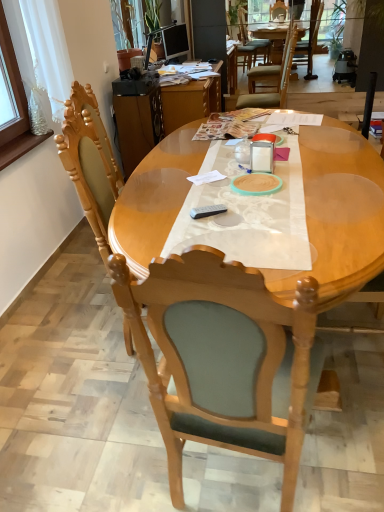
Question: Considering the relative positions of light wood table at center and wooden chair at center, placed as the 2th chair when sorted from back to front, in the image provided, is light wood table at center to the left of wooden chair at center, placed as the 2th chair when sorted from back to front, from the viewer's perspective?

Choices:
 (A) no
 (B) yes

Answer: (A)

Question: Does light wood table at center contain wooden chair at center, marked as the 1th chair in a bottom-to-top arrangement?

Choices:
 (A) yes
 (B) no

Answer: (A)

Question: Is light wood table at center not inside wooden chair at center, which is counted as the first chair, starting from the front?

Choices:
 (A) yes
 (B) no

Answer: (A)

Question: From the image's perspective, is light wood table at center on wooden chair at center, which appears as the first chair when viewed from the left?

Choices:
 (A) no
 (B) yes

Answer: (B)

Question: Can you confirm if light wood table at center is positioned to the right of wooden chair at center, marked as the 1th chair in a bottom-to-top arrangement?

Choices:
 (A) no
 (B) yes

Answer: (B)

Question: Is light wood table at center taller than wooden chair at center, which is counted as the first chair, starting from the front?

Choices:
 (A) no
 (B) yes

Answer: (A)

Question: Would you say light wood table at center is outside wooden desk at center?

Choices:
 (A) yes
 (B) no

Answer: (A)

Question: Can you confirm if light wood table at center is thinner than wooden desk at center?

Choices:
 (A) no
 (B) yes

Answer: (A)

Question: From a real-world perspective, is light wood table at center below wooden desk at center?

Choices:
 (A) yes
 (B) no

Answer: (B)

Question: Can you confirm if light wood table at center is smaller than wooden desk at center?

Choices:
 (A) yes
 (B) no

Answer: (B)

Question: Is light wood table at center not near wooden desk at center?

Choices:
 (A) no
 (B) yes

Answer: (B)

Question: Is light wood table at center turned away from wooden desk at center?

Choices:
 (A) yes
 (B) no

Answer: (B)

Question: Is wooden desk at center at the left side of wooden chair at center, marked as the 1th chair in a bottom-to-top arrangement?

Choices:
 (A) no
 (B) yes

Answer: (B)